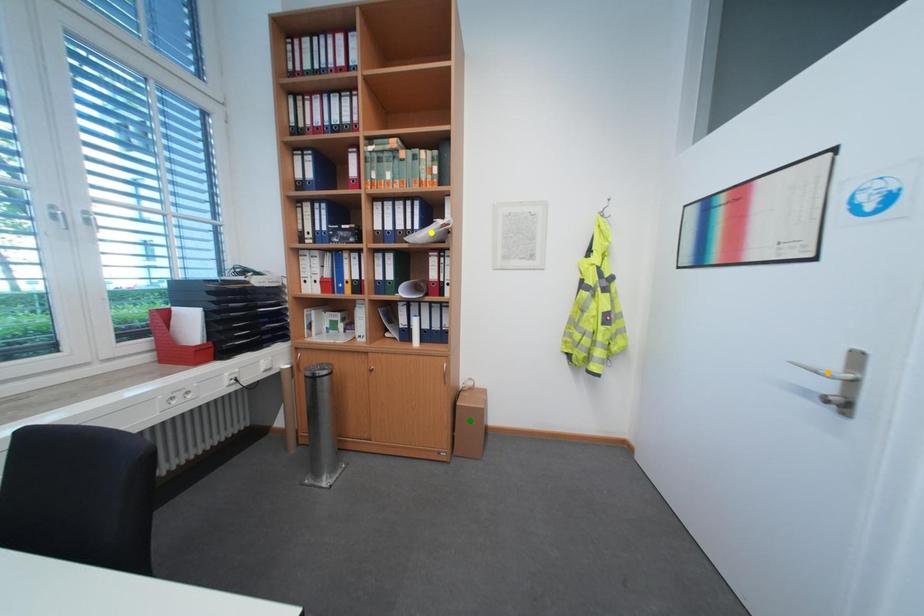
Order these from nearest to farthest:
- green point
- yellow point
- orange point

orange point → yellow point → green point